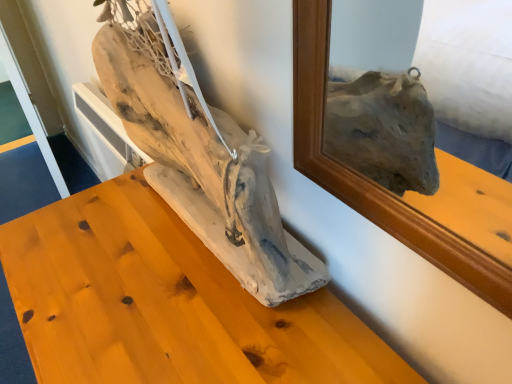
This screenshot has height=384, width=512. I want to click on driftwood sculpture at center, so click(x=166, y=303).

What do you see at coordinates (166, 303) in the screenshot?
I see `driftwood sculpture at center` at bounding box center [166, 303].

You are a GUI agent. You are given a task and a screenshot of the screen. Output one action in this format:
    pyautogui.click(x=<x>, y=<y>)
    Task: Click on the natural wood driftwood at center
    
    Given the screenshot: What is the action you would take?
    pyautogui.click(x=201, y=157)

Describe the element at coordinates (201, 157) in the screenshot. I see `natural wood driftwood at center` at that location.

Where is `driftwood sculpture at center`? driftwood sculpture at center is located at coordinates (166, 303).

Which object is positioned more to the left, driftwood sculpture at center or natural wood driftwood at center?

driftwood sculpture at center.

Between driftwood sculpture at center and natural wood driftwood at center, which one is positioned behind?

driftwood sculpture at center is further from the camera.

Which is closer, (x=48, y=358) or (x=221, y=159)?

Point (x=48, y=358) is farther from the camera than point (x=221, y=159).

From the image's perspective, which one is positioned higher, driftwood sculpture at center or natural wood driftwood at center?

natural wood driftwood at center, from the image's perspective.

From a real-world perspective, which object rests below the other?

From a 3D spatial view, driftwood sculpture at center is below.

Is driftwood sculpture at center thinner than natural wood driftwood at center?

No.

Does driftwood sculpture at center have a greater height compared to natural wood driftwood at center?

Yes, driftwood sculpture at center is taller than natural wood driftwood at center.

Considering the sizes of objects driftwood sculpture at center and natural wood driftwood at center in the image provided, who is bigger, driftwood sculpture at center or natural wood driftwood at center?

driftwood sculpture at center is bigger.

Based on the photo, is driftwood sculpture at center inside or outside of natural wood driftwood at center?

driftwood sculpture at center is located beyond the bounds of natural wood driftwood at center.

Is driftwood sculpture at center positioned far away from natural wood driftwood at center?

They are positioned close to each other.

Is driftwood sculpture at center positioned with its back to natural wood driftwood at center?

driftwood sculpture at center does not have its back to natural wood driftwood at center.

Measure the distance from driftwood sculpture at center to natural wood driftwood at center.

driftwood sculpture at center is 6.21 inches from natural wood driftwood at center.

Find the location of a particular element. The image size is (512, 384). sculpture on the right of driftwood sculpture at center is located at coordinates (201, 157).

Is natural wood driftwood at center at the right side of driftwood sculpture at center?

Yes.

In the scene shown: Relative to driftwood sculpture at center, is natural wood driftwood at center in front or behind?

In the image, natural wood driftwood at center appears in front of driftwood sculpture at center.

Is point (170, 158) less distant than point (73, 220)?

Yes, point (170, 158) is closer to viewer.

From the image's perspective, is natural wood driftwood at center under driftwood sculpture at center?

No.

From a real-world perspective, is natural wood driftwood at center located higher than driftwood sculpture at center?

Yes, from a real-world perspective, natural wood driftwood at center is on top of driftwood sculpture at center.

Which object is wider, natural wood driftwood at center or driftwood sculpture at center?

driftwood sculpture at center is wider.

Considering the relative sizes of natural wood driftwood at center and driftwood sculpture at center in the image provided, is natural wood driftwood at center shorter than driftwood sculpture at center?

Yes, natural wood driftwood at center is shorter than driftwood sculpture at center.

Considering the sizes of objects natural wood driftwood at center and driftwood sculpture at center in the image provided, who is bigger, natural wood driftwood at center or driftwood sculpture at center?

With larger size is driftwood sculpture at center.

Does natural wood driftwood at center contain driftwood sculpture at center?

No.

Is natural wood driftwood at center in contact with driftwood sculpture at center?

They are not placed beside each other.

Could you tell me if natural wood driftwood at center is facing driftwood sculpture at center?

No, natural wood driftwood at center is not facing towards driftwood sculpture at center.

How many degrees apart are the facing directions of natural wood driftwood at center and driftwood sculpture at center?

The angle between the facing direction of natural wood driftwood at center and the facing direction of driftwood sculpture at center is 2.79 degrees.

This screenshot has height=384, width=512. In order to click on sculpture on the right of driftwood sculpture at center in this screenshot , I will do `click(201, 157)`.

Where is `furniture below the natural wood driftwood at center (from a real-world perspective)`? The width and height of the screenshot is (512, 384). furniture below the natural wood driftwood at center (from a real-world perspective) is located at coordinates (166, 303).

The image size is (512, 384). What are the coordinates of `furniture below the natural wood driftwood at center (from the image's perspective)` in the screenshot? It's located at (166, 303).